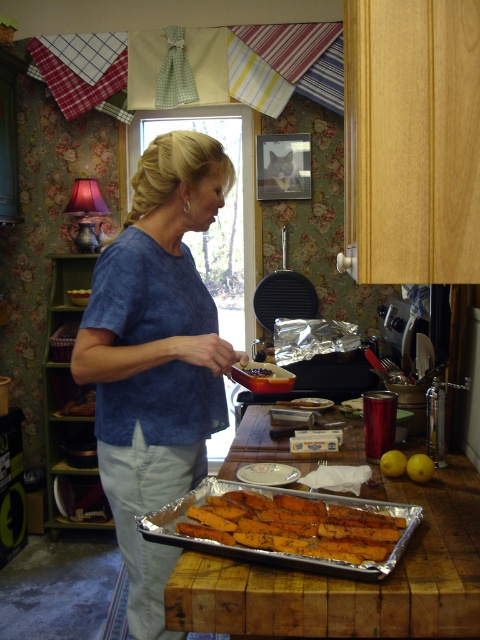
Does golden brown crispy sticks at lower center have a greater width compared to brown crispy bread at center?

Indeed, golden brown crispy sticks at lower center has a greater width compared to brown crispy bread at center.

Is golden brown crispy sticks at lower center bigger than brown crispy bread at center?

Correct, golden brown crispy sticks at lower center is larger in size than brown crispy bread at center.

Locate an element on the screen. The height and width of the screenshot is (640, 480). golden brown crispy sticks at lower center is located at coordinates (294, 525).

Find the location of `golden brown crispy sticks at lower center`. golden brown crispy sticks at lower center is located at coordinates (294, 525).

Is blue cotton shirt at center bigger than golden brown crispy sticks at lower center?

Correct, blue cotton shirt at center is larger in size than golden brown crispy sticks at lower center.

Can you confirm if blue cotton shirt at center is positioned below golden brown crispy sticks at lower center?

No.

Locate an element on the screen. Image resolution: width=480 pixels, height=640 pixels. blue cotton shirt at center is located at coordinates (156, 356).

Where is `blue cotton shirt at center`? blue cotton shirt at center is located at coordinates (156, 356).

Is golden brown crispy sticks at lower center wider than white glossy platter at center?

Indeed, golden brown crispy sticks at lower center has a greater width compared to white glossy platter at center.

Consider the image. Does golden brown crispy sticks at lower center come behind white glossy platter at center?

No, it is not.

Who is more distant from viewer, (242, 506) or (271, 470)?

Point (271, 470)

I want to click on golden brown crispy sticks at lower center, so click(294, 525).